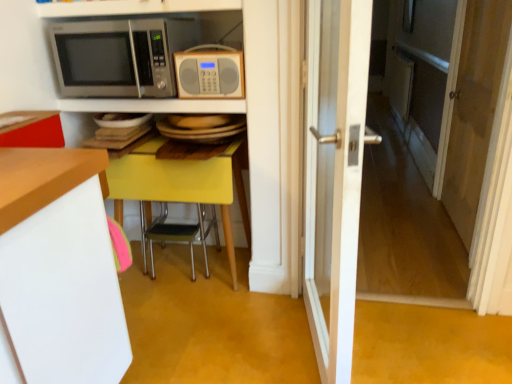
Question: Is satin silver microwave at upper left, which ranks as the second microwave oven in right-to-left order, positioned with its back to metallic yellow chair at center?

Choices:
 (A) yes
 (B) no

Answer: (B)

Question: From the image's perspective, does satin silver microwave at upper left, the first microwave oven when ordered from left to right, appear higher than metallic yellow chair at center?

Choices:
 (A) yes
 (B) no

Answer: (A)

Question: Considering the relative positions of satin silver microwave at upper left, which ranks as the second microwave oven in right-to-left order, and metallic yellow chair at center in the image provided, is satin silver microwave at upper left, which ranks as the second microwave oven in right-to-left order, to the left of metallic yellow chair at center from the viewer's perspective?

Choices:
 (A) no
 (B) yes

Answer: (B)

Question: Can you confirm if satin silver microwave at upper left, the first microwave oven when ordered from left to right, is positioned to the right of metallic yellow chair at center?

Choices:
 (A) no
 (B) yes

Answer: (A)

Question: Is satin silver microwave at upper left, the first microwave oven when ordered from left to right, positioned in front of metallic yellow chair at center?

Choices:
 (A) no
 (B) yes

Answer: (B)

Question: Considering the relative sizes of satin silver microwave at upper left, the first microwave oven when ordered from left to right, and metallic yellow chair at center in the image provided, is satin silver microwave at upper left, the first microwave oven when ordered from left to right, smaller than metallic yellow chair at center?

Choices:
 (A) yes
 (B) no

Answer: (A)

Question: Considering the relative sizes of matte gray radio at center, placed as the second microwave oven when sorted from left to right, and white wooden door at center in the image provided, is matte gray radio at center, placed as the second microwave oven when sorted from left to right, wider than white wooden door at center?

Choices:
 (A) yes
 (B) no

Answer: (B)

Question: Can you confirm if matte gray radio at center, placed as the second microwave oven when sorted from left to right, is positioned to the left of white wooden door at center?

Choices:
 (A) yes
 (B) no

Answer: (A)

Question: From the image's perspective, is matte gray radio at center, placed as the second microwave oven when sorted from left to right, under white wooden door at center?

Choices:
 (A) no
 (B) yes

Answer: (A)

Question: Is matte gray radio at center, marked as the first microwave oven in a right-to-left arrangement, facing away from white wooden door at center?

Choices:
 (A) no
 (B) yes

Answer: (A)

Question: From a real-world perspective, is matte gray radio at center, placed as the second microwave oven when sorted from left to right, positioned over white wooden door at center based on gravity?

Choices:
 (A) yes
 (B) no

Answer: (A)

Question: From a real-world perspective, is satin silver microwave at upper left, the first microwave oven when ordered from left to right, beneath yellow glossy table at center?

Choices:
 (A) no
 (B) yes

Answer: (A)